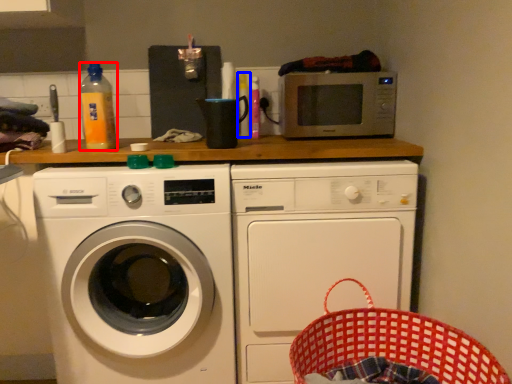
Question: Which point is further to the camera, bottle (highlighted by a red box) or bottle (highlighted by a blue box)?

Choices:
 (A) bottle
 (B) bottle

Answer: (B)